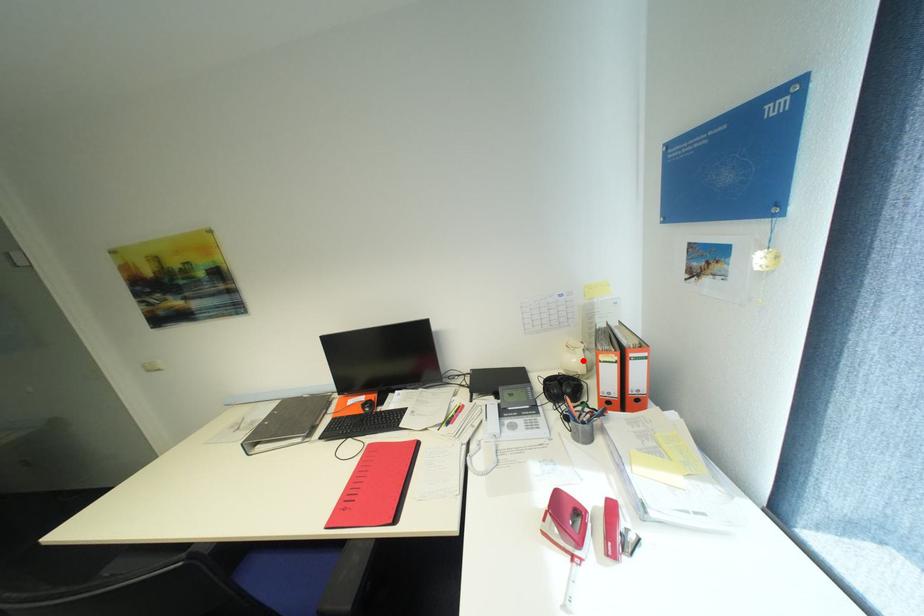
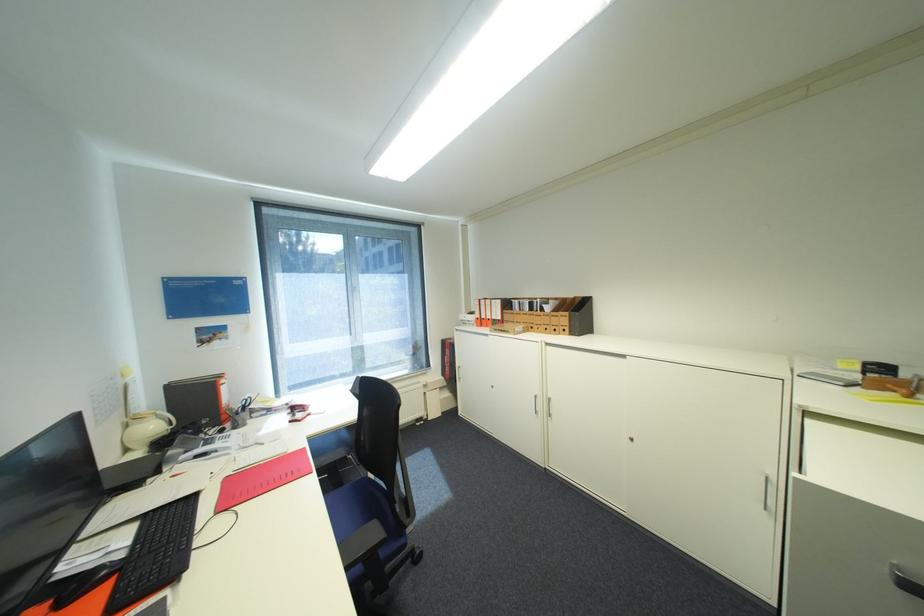
Locate, in the second image, the point that corresponds to the highlighted location in the first image.

(161, 427)